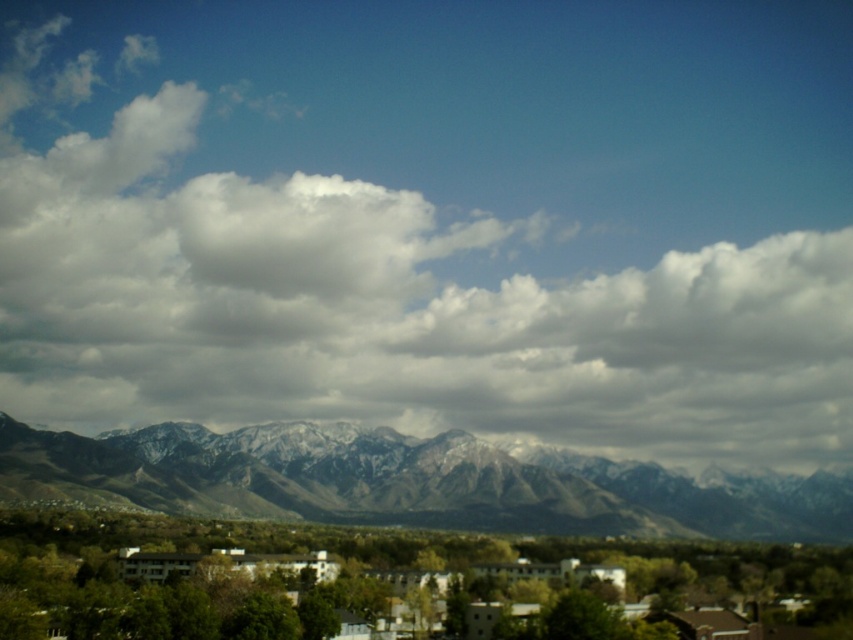
Question: Can you confirm if white fluffy cloud at upper center is positioned to the right of snowy rock mountain range at center?

Choices:
 (A) no
 (B) yes

Answer: (A)

Question: Which object is the closest to the white fluffy cloud at upper center?

Choices:
 (A) snowy rock mountain range at center
 (B) green matte buildings at center

Answer: (A)

Question: Among these points, which one is farthest from the camera?

Choices:
 (A) (224, 513)
 (B) (592, 252)

Answer: (B)

Question: Which object is closer to the camera taking this photo?

Choices:
 (A) green matte buildings at center
 (B) white fluffy cloud at upper center
 (C) snowy rock mountain range at center

Answer: (A)

Question: Can you confirm if white fluffy cloud at upper center is positioned to the left of snowy rock mountain range at center?

Choices:
 (A) no
 (B) yes

Answer: (B)

Question: Can you confirm if white fluffy cloud at upper center is thinner than green matte buildings at center?

Choices:
 (A) no
 (B) yes

Answer: (A)